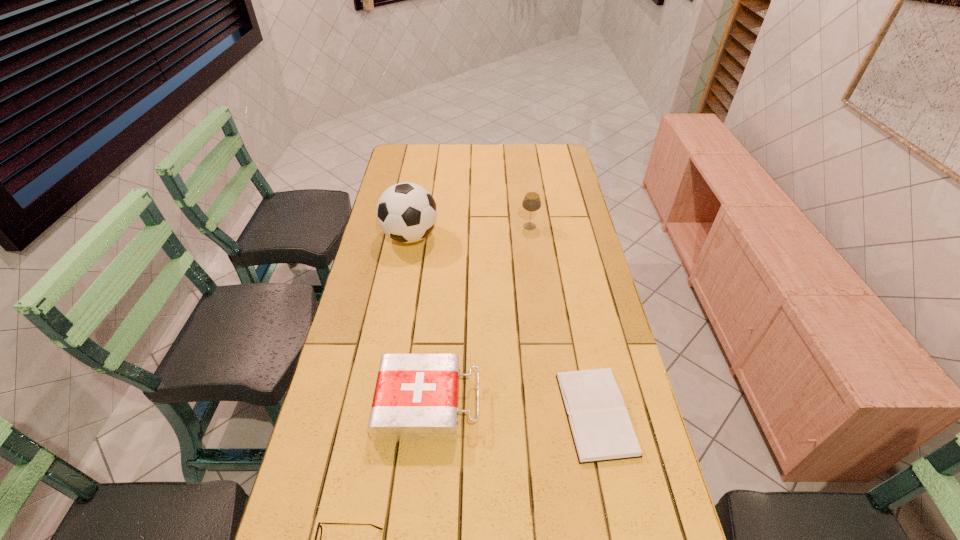
Image resolution: width=960 pixels, height=540 pixels. Identify the location of soccer ball. (406, 212).

At what (x,y) coordinates should I click in order to perform the action: click on the fourth shortest object. Please return your answer as a coordinate pair (x, y). The image size is (960, 540). Looking at the image, I should click on (531, 202).

Locate an element on the screen. This screenshot has height=540, width=960. the first-aid kit is located at coordinates (416, 396).

At what (x,y) coordinates should I click in order to perform the action: click on the shortest object. Please return your answer as a coordinate pair (x, y). Looking at the image, I should click on (601, 429).

The image size is (960, 540). What are the coordinates of `vacant area situated 0.200m on the back of the tallest object` in the screenshot? It's located at (419, 191).

At what (x,y) coordinates should I click in order to perform the action: click on vacant space situated on the left of the fourth shortest object. Please return your answer as a coordinate pair (x, y). The image size is (960, 540). Looking at the image, I should click on (444, 226).

Locate an element on the screen. vacant space located on the front side of the third tallest object is located at coordinates (588, 403).

Locate an element on the screen. This screenshot has height=540, width=960. vacant area situated on the front of the shortest object is located at coordinates (621, 536).

You are a GUI agent. You are given a task and a screenshot of the screen. Output one action in this format:
    pyautogui.click(x=<x>, y=<y>)
    Task: Click on the soccer ball positioned at the left edge
    This screenshot has width=960, height=540.
    Given the screenshot: What is the action you would take?
    pyautogui.click(x=406, y=212)

Identify the location of the first-aid kit situated at the left edge. This screenshot has width=960, height=540. (416, 396).